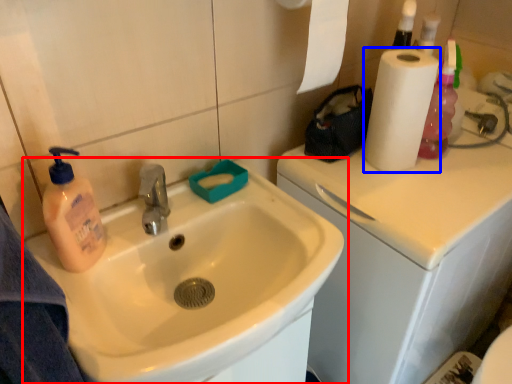
Question: Among these objects, which one is farthest to the camera, sink (highlighted by a red box) or paper towel (highlighted by a blue box)?

Choices:
 (A) sink
 (B) paper towel

Answer: (B)